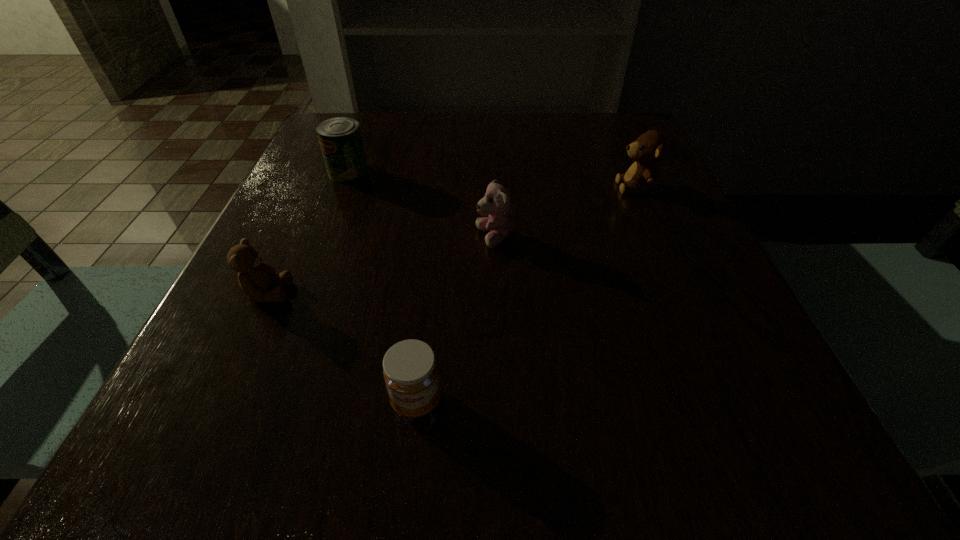
The image size is (960, 540). I want to click on free space that is in between the leftmost teddy bear and the nearest object, so click(343, 347).

This screenshot has width=960, height=540. Identify the location of vacant space that is in between the can and the fourth farthest object. (x=308, y=232).

Locate an element on the screen. This screenshot has width=960, height=540. free point between the can and the jam is located at coordinates (382, 287).

Where is `free space between the can and the nearest teddy bear`? This screenshot has height=540, width=960. free space between the can and the nearest teddy bear is located at coordinates (308, 232).

At what (x,y) coordinates should I click in order to perform the action: click on vacant region between the rightmost teddy bear and the can. Please return your answer as a coordinate pair (x, y). Looking at the image, I should click on (492, 179).

This screenshot has width=960, height=540. I want to click on vacant space that's between the third farthest object and the rightmost teddy bear, so click(564, 212).

Image resolution: width=960 pixels, height=540 pixels. I want to click on unoccupied area between the second nearest object and the third object from left to right, so pyautogui.click(x=343, y=347).

You are a GUI agent. You are given a task and a screenshot of the screen. Output one action in this format:
    pyautogui.click(x=<x>, y=<y>)
    Task: Click on the free space between the fourth object from left to right and the can
    
    Given the screenshot: What is the action you would take?
    pyautogui.click(x=421, y=205)

At what (x,y) coordinates should I click in order to perform the action: click on object that stands as the fourth closest to the second farthest teddy bear. Please return your answer as a coordinate pair (x, y). Image resolution: width=960 pixels, height=540 pixels. Looking at the image, I should click on (256, 278).

Locate which object ranks third in proximity to the can. Please provide its 2D coordinates. Your answer should be formatted as a tuple, i.e. [(x, y)], where the tuple contains the x and y coordinates of a point satisfying the conditions above.

[(410, 370)]